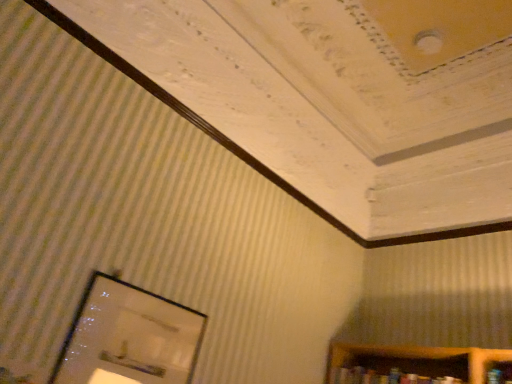
Question: Is point (362, 380) positioned closer to the camera than point (203, 314)?

Choices:
 (A) closer
 (B) farther

Answer: (B)

Question: Which is correct: hardcover book at lower right is inside matte glass picture frame at lower left, or outside of it?

Choices:
 (A) inside
 (B) outside

Answer: (B)

Question: Looking at the image, does hardcover book at lower right seem bigger or smaller compared to matte glass picture frame at lower left?

Choices:
 (A) small
 (B) big

Answer: (B)

Question: In the image, is matte glass picture frame at lower left positioned in front of or behind hardcover book at lower right?

Choices:
 (A) front
 (B) behind

Answer: (A)

Question: Does point coord(166,352) appear closer or farther from the camera than point coord(429,375)?

Choices:
 (A) closer
 (B) farther

Answer: (A)

Question: In the image, is matte glass picture frame at lower left on the left side or the right side of hardcover book at lower right?

Choices:
 (A) right
 (B) left

Answer: (B)

Question: Would you say matte glass picture frame at lower left is inside or outside hardcover book at lower right?

Choices:
 (A) inside
 (B) outside

Answer: (B)